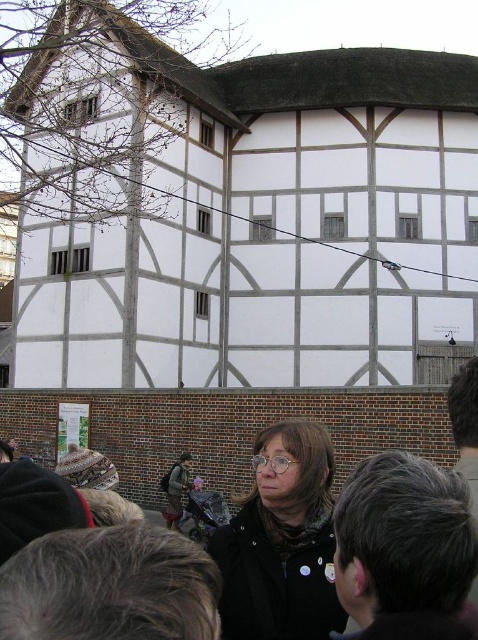
Question: Does dark gray hair at upper right appear on the right side of matte black coat at center?

Choices:
 (A) no
 (B) yes

Answer: (B)

Question: Which point is farther to the camera?

Choices:
 (A) matte black coat at center
 (B) dark gray hair at upper right

Answer: (A)

Question: Is dark gray hair at upper right to the left of matte black coat at center from the viewer's perspective?

Choices:
 (A) no
 (B) yes

Answer: (A)

Question: Does dark gray hair at upper right appear over matte black coat at center?

Choices:
 (A) yes
 (B) no

Answer: (A)

Question: Which object appears closest to the camera in this image?

Choices:
 (A) matte black coat at center
 (B) dark gray hair at upper right

Answer: (B)

Question: Which point is farther to the camera?

Choices:
 (A) dark gray hair at upper right
 (B) matte black coat at center

Answer: (B)